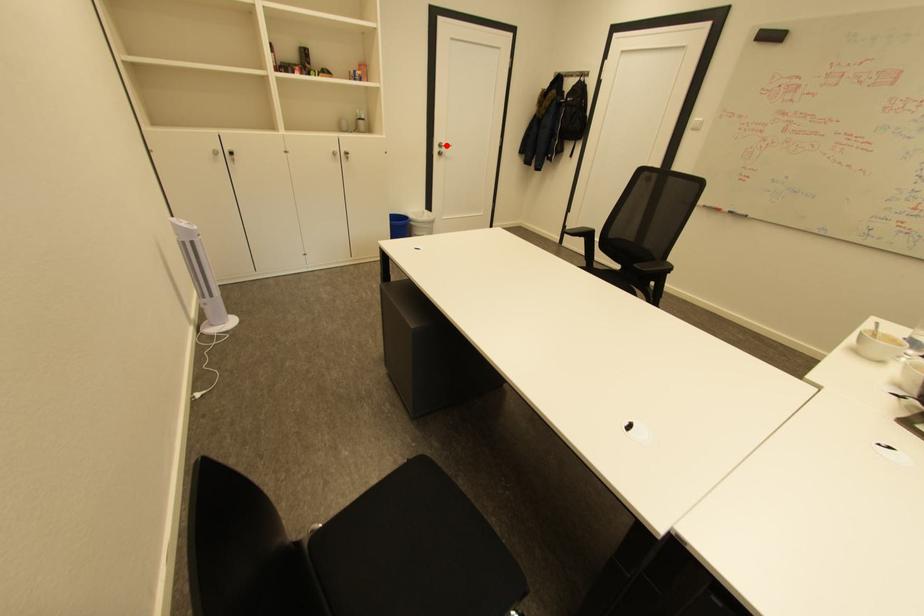
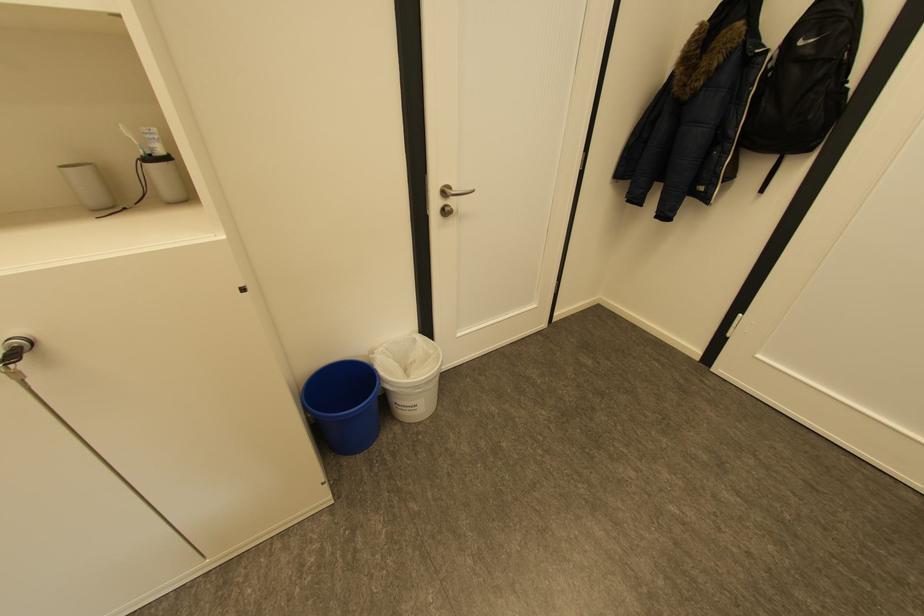
Question: I am providing you with two images of the same scene from different viewpoints. Given a red point in image1, look at the same physical point in image2. Is it:

Choices:
 (A) Closer to the viewpoint
 (B) Farther from the viewpoint

Answer: (B)